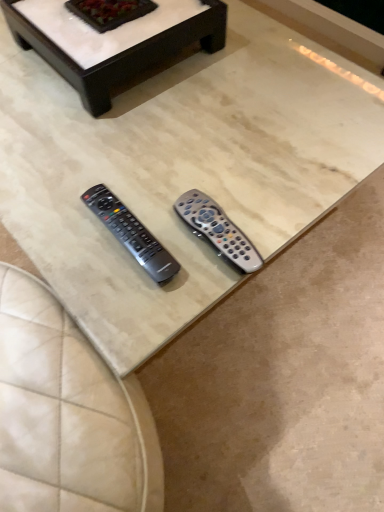
This screenshot has height=512, width=384. Identify the location of vacant space that's between translucent gray remote at center, positioned as the 2th remote control in left-to-right order, and white marble coffee table at upper center, which ranks as the first coffee table in back-to-front order. (189, 137).